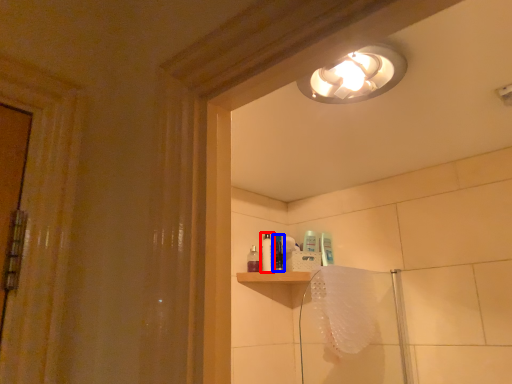
Question: Among these objects, which one is nearest to the camera, toiletry (highlighted by a red box) or toiletry (highlighted by a blue box)?

Choices:
 (A) toiletry
 (B) toiletry

Answer: (B)